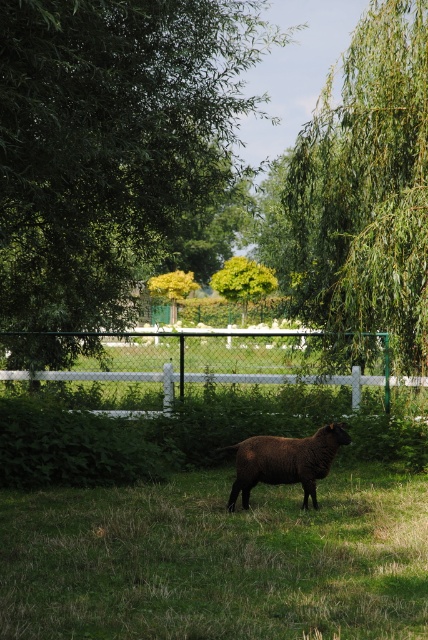
You are a painter setting up your easel in the rural scene. You want to paint the green leafy willow at upper right and the white wooden fence at center. Which object should you focus on first if you want to paint the thinner one?

The green leafy willow at upper right is thinner than the white wooden fence at center, so you should focus on painting the green leafy willow at upper right first.